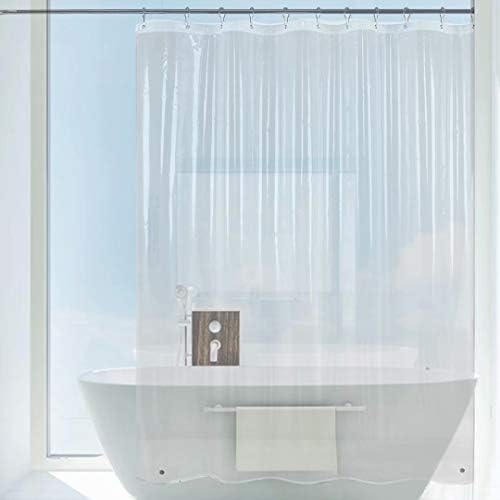
Find the location of a particular element. The width and height of the screenshot is (500, 500). curtain is located at coordinates (346, 212).